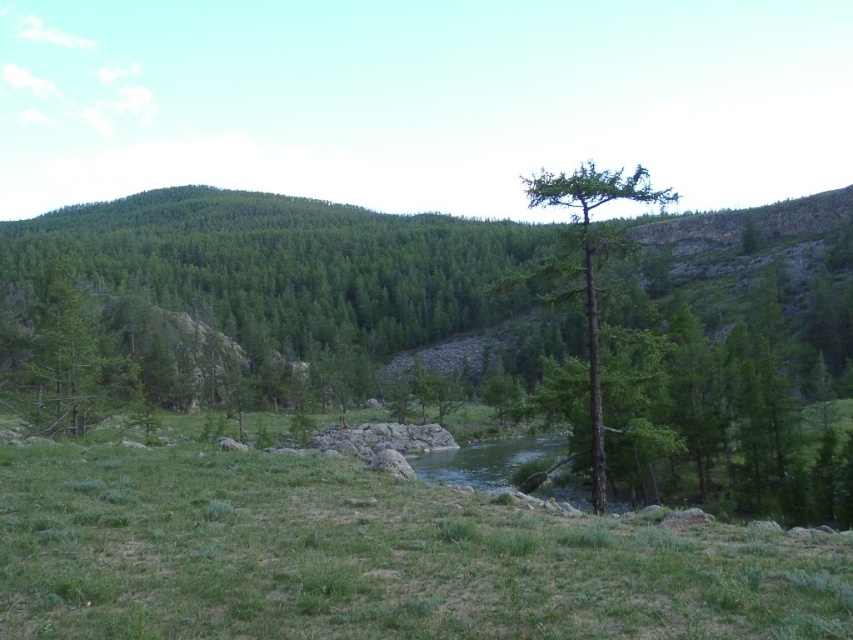
You are standing in the middle of the green grassy at center and want to walk towards the green matte tree at left. Which direction should you head?

To walk towards the green matte tree at left from the green grassy at center, you should head to the left since the green grassy at center is located to the right of the green matte tree at left.

You are an environmental scientist analyzing the forest composition. You observe the green matte tree at left and the green rough bark tree at center. Which tree takes up more area in the image?

The green rough bark tree at center occupies more space than the green matte tree at left, so it takes up more area in the image.

You are a photographer standing at the edge of the forest. You want to take a photo of the green matte tree at left. If your camera has a maximum zoom range of 30 meters, can you capture the tree without moving closer?

The green matte tree at left is 33.27 meters from camera, which exceeds the camera maximum zoom range of 30 meters. Therefore, you cannot capture the tree without moving closer.